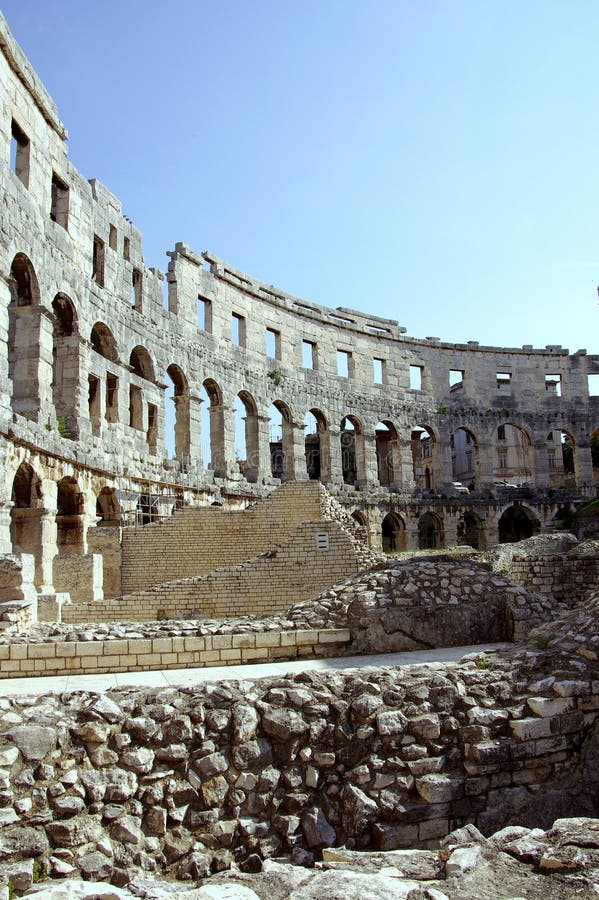
At what (x,y) coordinates should I click in order to perform the action: click on walls. Please return your answer as a coordinate pair (x, y). Looking at the image, I should click on (314, 781), (432, 595), (278, 573), (207, 534).